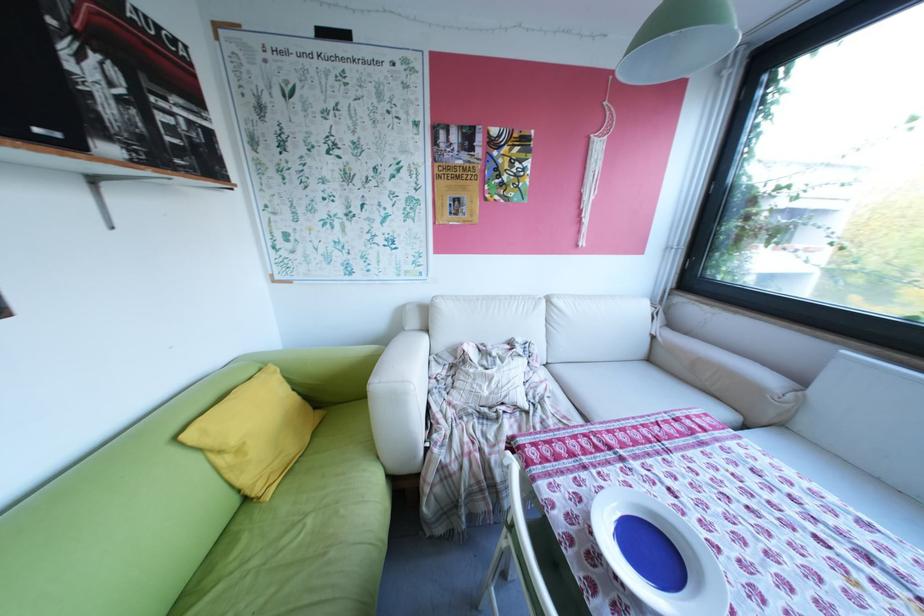
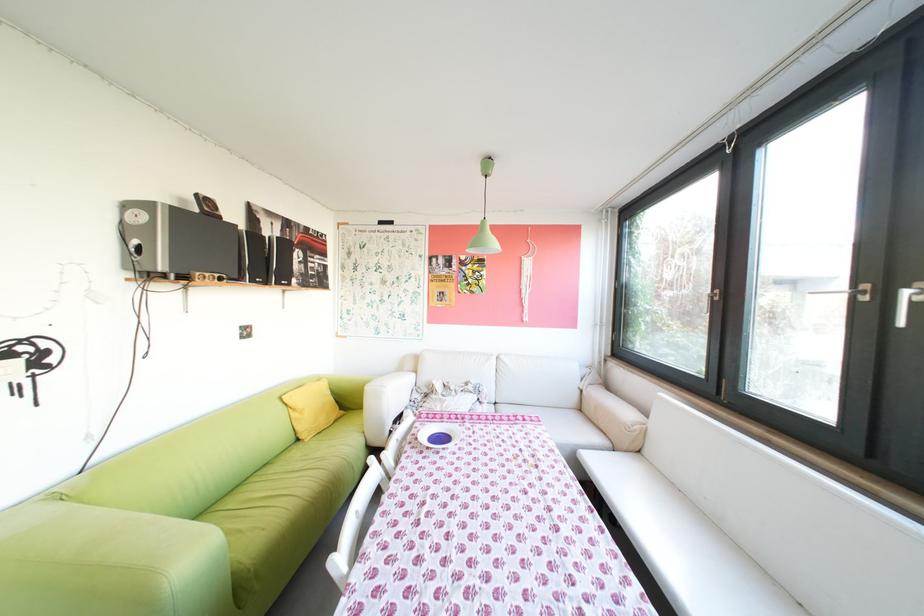
In a continuous first-person perspective shot, in which direction is the camera moving?

The cameraman moved toward right, backward.